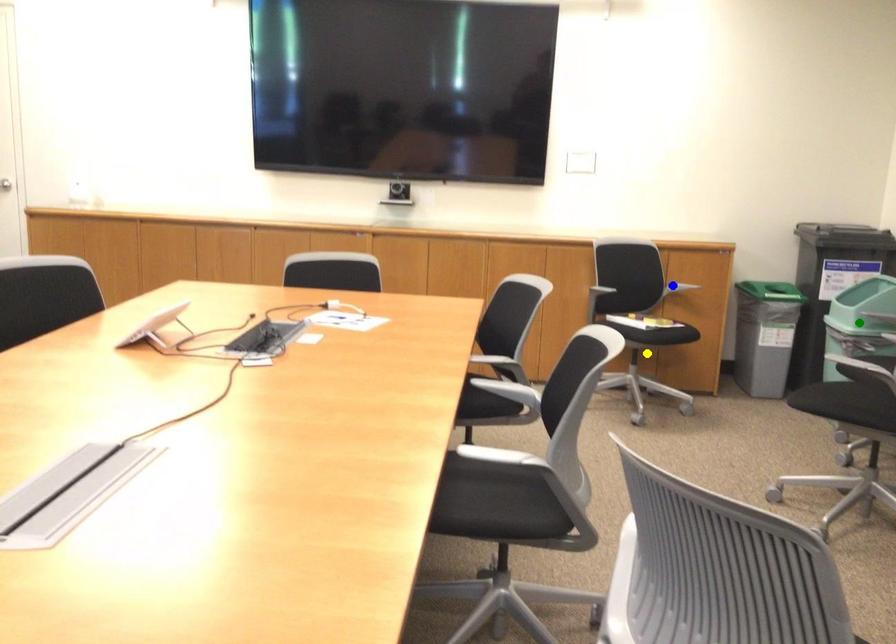
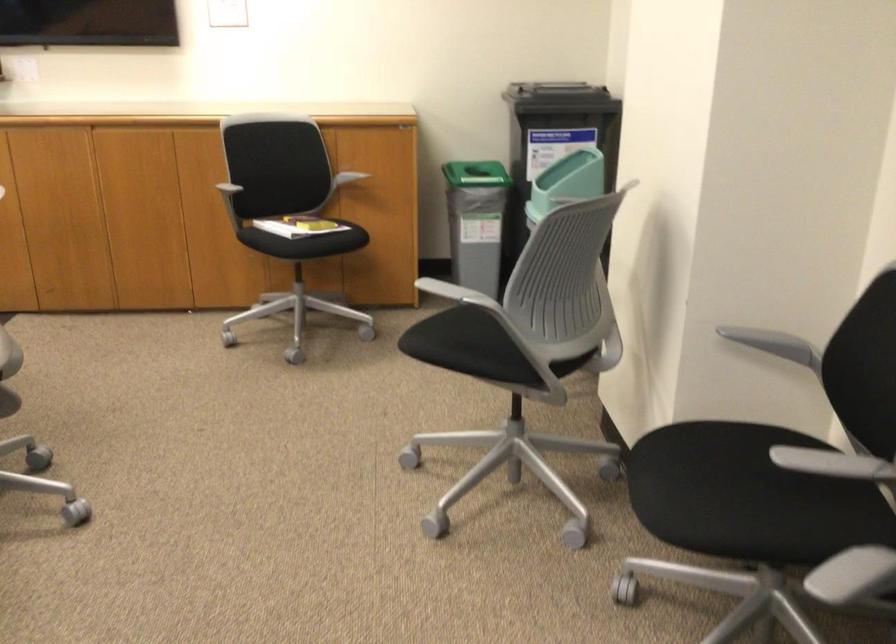
I am providing you with two images of the same scene from different viewpoints. Three points are marked in image1. Which point corresponds to a part or object that is occluded in image2?In image1, three points are marked. Which of them correspond to a part or object that is occluded in image2?Among the three points shown in image1, which one corresponds to a part or object that is no longer visible due to occlusion in image2?

blue point, yellow point, green point